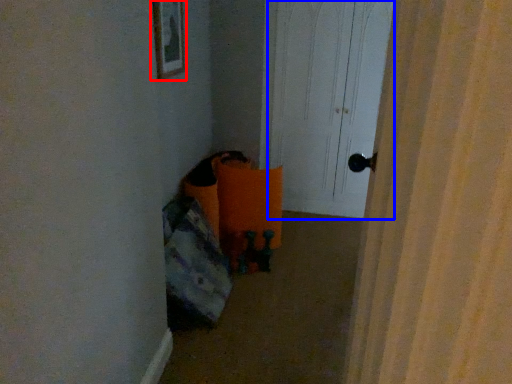
Question: Which point is further to the camera, picture frame (highlighted by a red box) or screen door (highlighted by a blue box)?

Choices:
 (A) picture frame
 (B) screen door

Answer: (B)